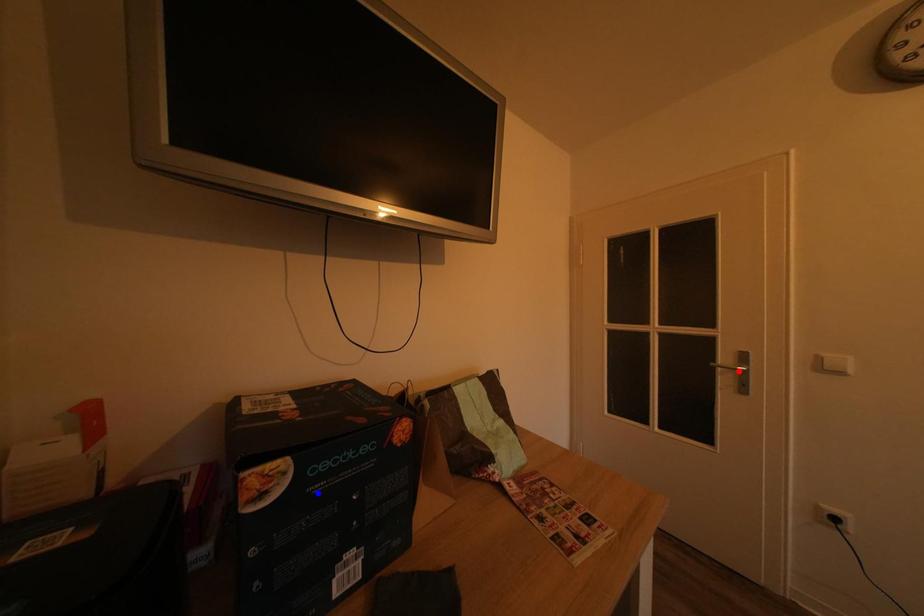
Question: In the image, two points are highlighted. Which point is nearer to the camera? Reply with the corresponding letter.

Choices:
 (A) blue point
 (B) red point

Answer: (A)